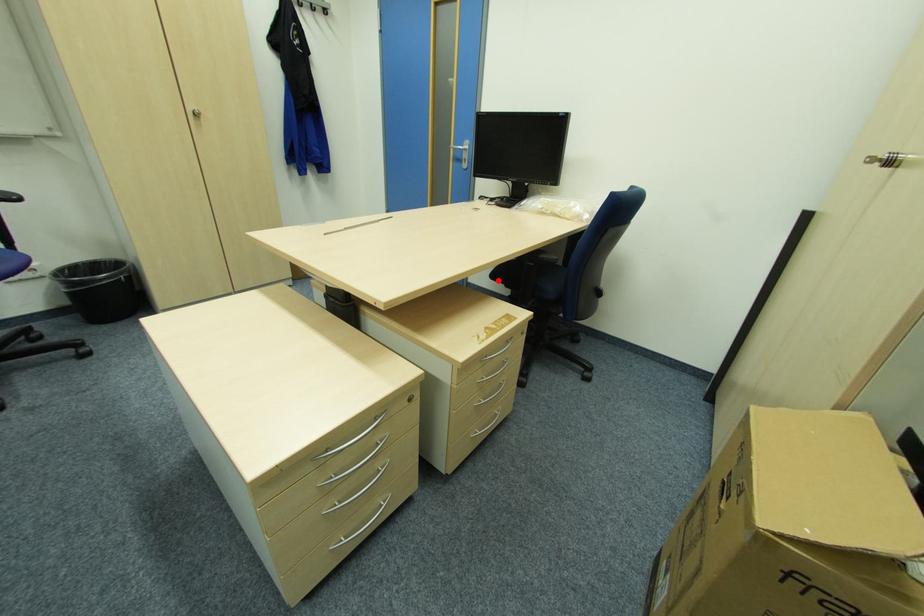
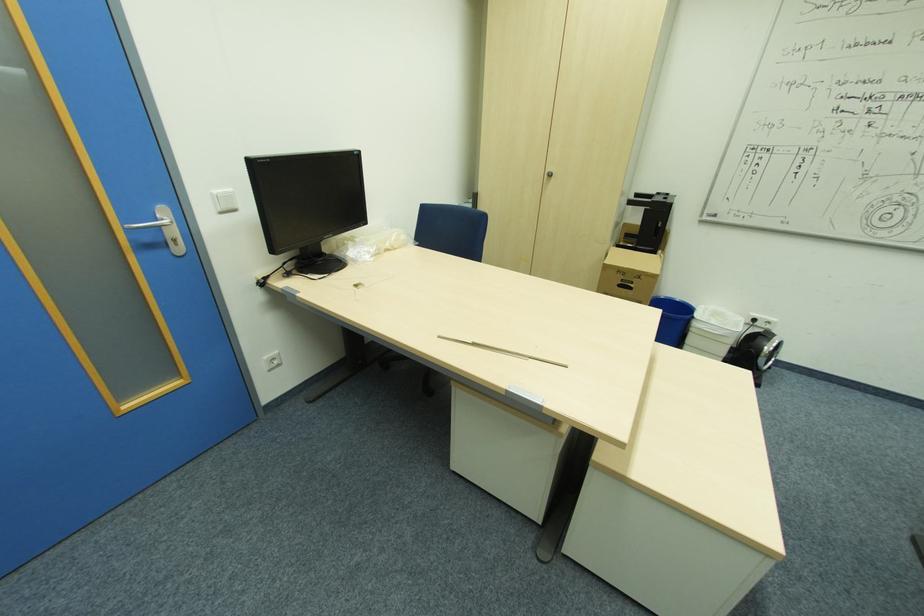
Question: I am providing you with two images of the same scene from different viewpoints. A red point is marked on the first image. At the location where the point appears in image 1, is it still visible in image 2?

Choices:
 (A) Yes
 (B) No

Answer: (B)